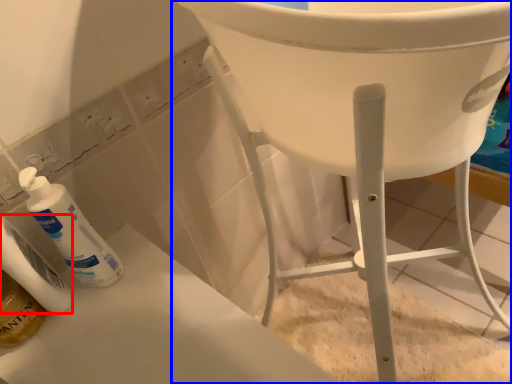
Question: Which point is further to the camera, toiletry (highlighted by a red box) or furniture (highlighted by a blue box)?

Choices:
 (A) toiletry
 (B) furniture

Answer: (B)